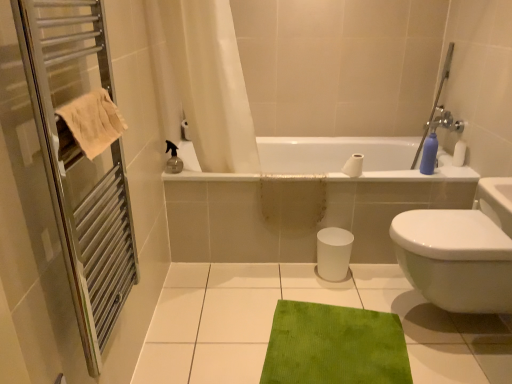
Find the location of a particular element. The height and width of the screenshot is (384, 512). free space that is in between blue matte bottle at upper right and white matte toilet paper at upper center is located at coordinates (388, 177).